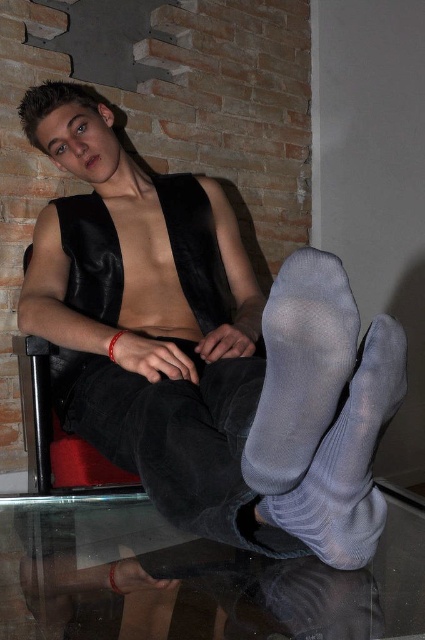
You are a photographer setting up a shoot. You need to place a 12 inch wide decorative item on the transparent glass table at lower center. The gray knitted sock at lower center is currently on the table. Can the item fit on the table without overlapping the sock?

The transparent glass table at lower center has a width larger than the gray knitted sock at lower center, so the 12 inch wide decorative item can fit on the table without overlapping the sock.

You are a photographer setting up for a portrait. You need to ensure that the subject wearing the satin black vest at upper center and gray mesh socks at lower center are both visible in the frame. Given their positions, which object should you focus on first to ensure both are in focus?

The satin black vest at upper center is taller than the gray mesh socks at lower center. To ensure both are in focus, you should focus on the satin black vest at upper center first since it is the taller object and likely farther away, requiring a deeper depth of field.